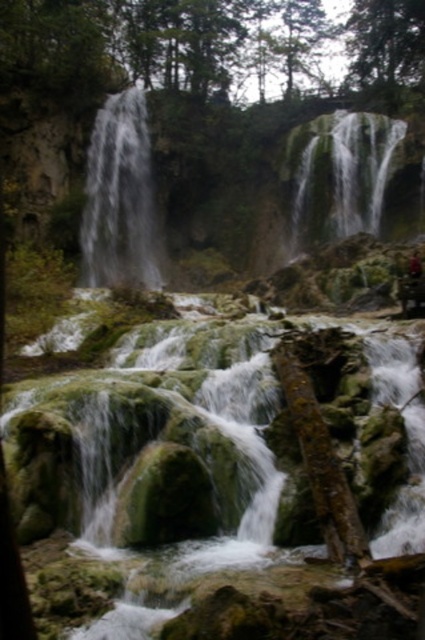
You are a photographer planning to capture a photo of the camouflage fabric hiker at center and the green mossy rock at upper right. You want to ensure the hiker is in focus while the rock is slightly blurred in the background. Is this possible given their positions?

The green mossy rock at upper right is much taller than the camouflage fabric hiker at center. Since the rock is taller, it would be further away from the camera, making it possible to have the hiker in focus with the rock blurred in the background.

You are a hiker trying to cross the rocky terrain in the scene. You notice the white frothy water at left and the camouflage fabric hiker at center. Which object is taller, and how might this affect your path?

The white frothy water at left is taller than the camouflage fabric hiker at center. This means the water might be deeper or more powerful in that area, so you should avoid crossing there to stay safe.